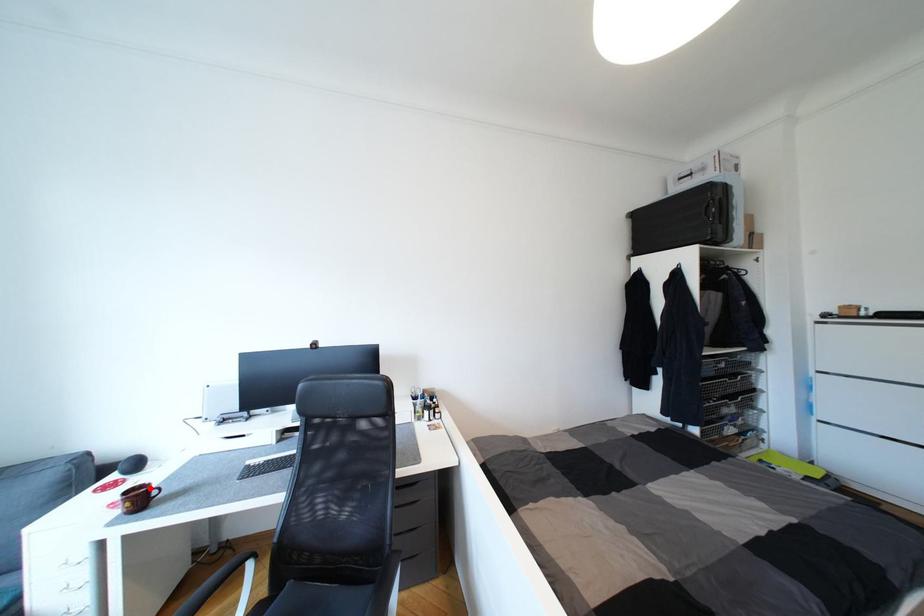
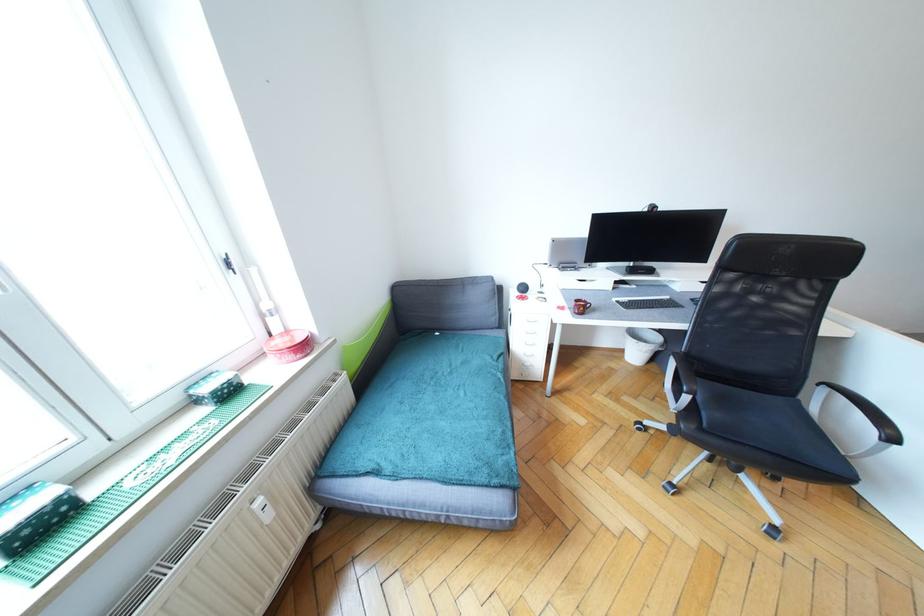
Where in the second image is the point corresponding to the highlighted location from the first image?

(589, 302)